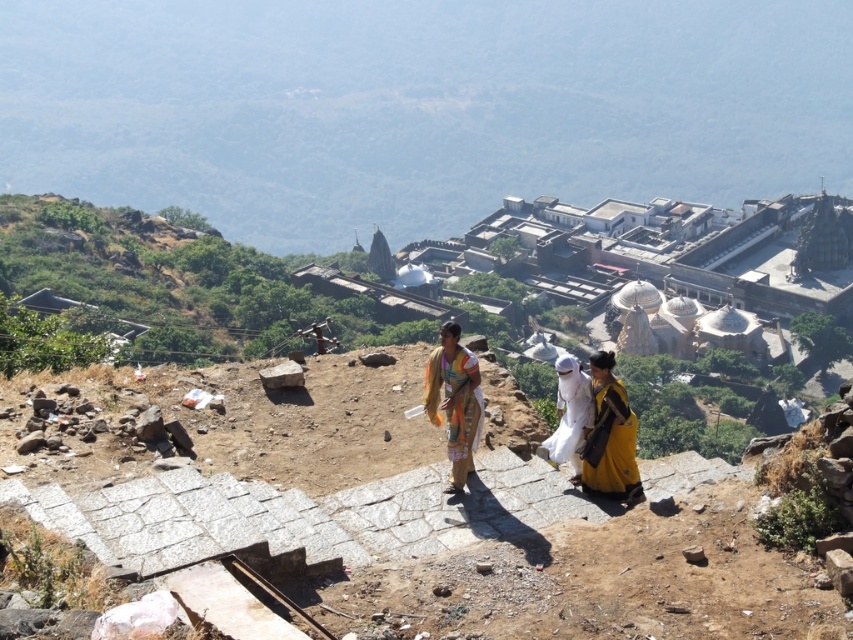
Question: Considering the relative positions of yellow fabric dress at lower right and multicolored fabric at center in the image provided, where is yellow fabric dress at lower right located with respect to multicolored fabric at center?

Choices:
 (A) right
 (B) left

Answer: (A)

Question: Which point is farther to the camera?

Choices:
 (A) yellow fabric dress at lower right
 (B) white cotton dress at center
 (C) multicolored fabric at center

Answer: (B)

Question: Where is multicolored fabric at center located in relation to white cotton dress at center in the image?

Choices:
 (A) left
 (B) right

Answer: (A)

Question: Which is farther from the multicolored fabric at center?

Choices:
 (A) white cotton dress at center
 (B) yellow fabric dress at lower right

Answer: (A)

Question: Estimate the real-world distances between objects in this image. Which object is farther from the white cotton dress at center?

Choices:
 (A) multicolored fabric at center
 (B) yellow fabric dress at lower right

Answer: (B)

Question: Considering the relative positions of yellow fabric dress at lower right and multicolored fabric at center in the image provided, where is yellow fabric dress at lower right located with respect to multicolored fabric at center?

Choices:
 (A) left
 (B) right

Answer: (B)